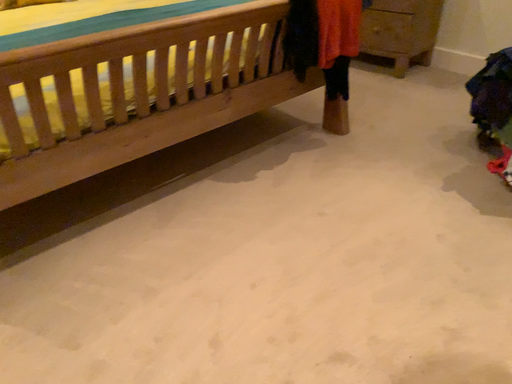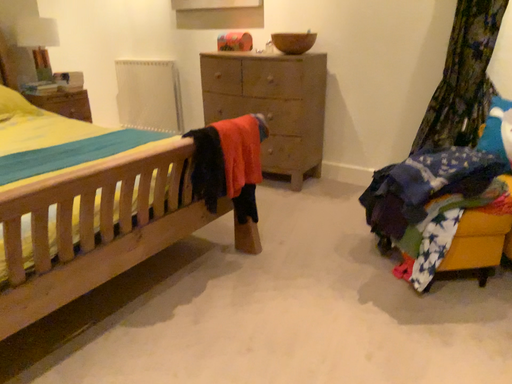
Question: How did the camera likely rotate when shooting the video?

Choices:
 (A) rotated right
 (B) rotated left

Answer: (A)